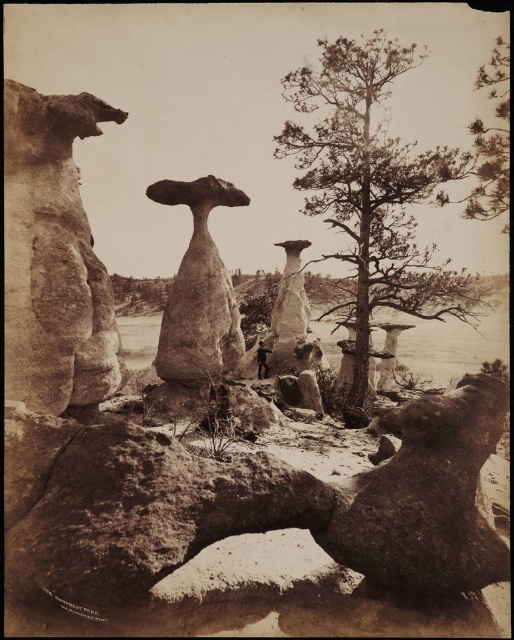
Measure the distance between smooth sandstone toadstool at left and smooth sandstone toadstool at center.

5.05 meters

Measure the distance between point (60,109) and camera.

Point (60,109) and camera are 11.78 meters apart from each other.

Identify the location of smooth sandstone toadstool at left. (53, 257).

Does green textured tree at center appear on the left side of smooth sandstone toadstool at center?

No, green textured tree at center is not to the left of smooth sandstone toadstool at center.

The height and width of the screenshot is (640, 514). I want to click on green textured tree at center, so (372, 186).

Can you confirm if green textured tree at center is thinner than smooth sandstone toadstool at left?

No, green textured tree at center is not thinner than smooth sandstone toadstool at left.

You are a GUI agent. You are given a task and a screenshot of the screen. Output one action in this format:
    pyautogui.click(x=<x>, y=<y>)
    Task: Click on the green textured tree at center
    This screenshot has width=514, height=640.
    Given the screenshot: What is the action you would take?
    pyautogui.click(x=372, y=186)